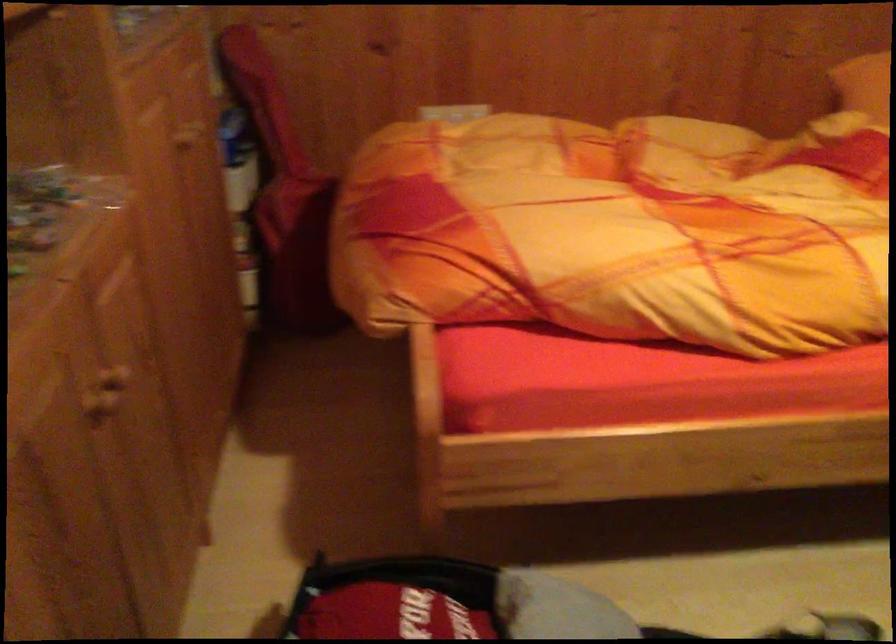
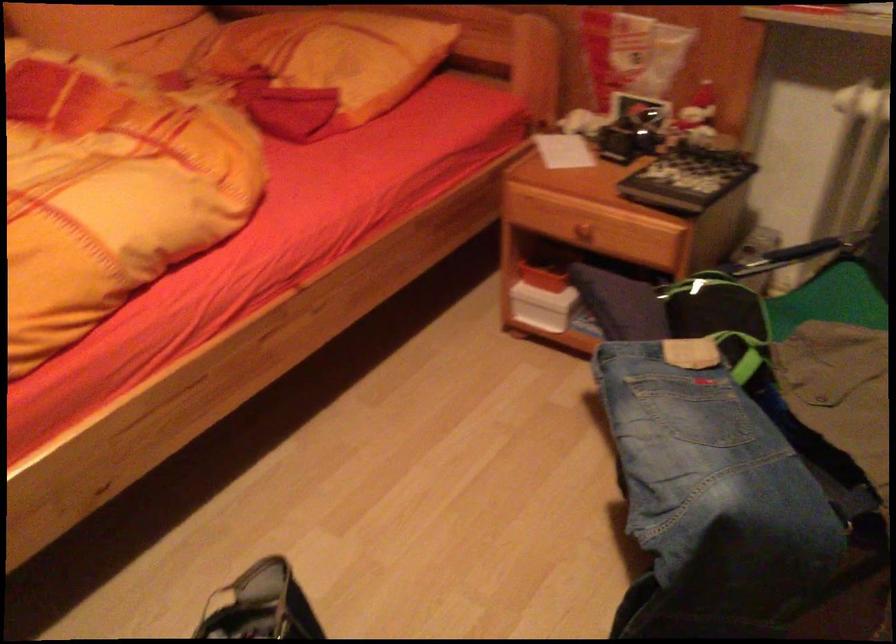
Question: Based on the continuous images, in which direction is the camera rotating? Reply with the corresponding letter.

Choices:
 (A) Left
 (B) Right
 (C) Up
 (D) Down

Answer: (B)